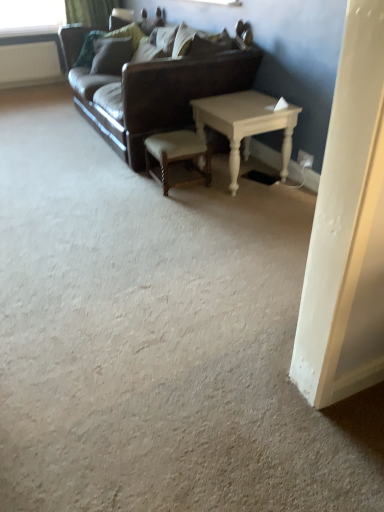
What is the approximate width of leather couch at center?

3.40 feet.

The height and width of the screenshot is (512, 384). Describe the element at coordinates (90, 12) in the screenshot. I see `green fabric curtain at upper left` at that location.

Locate an element on the screen. The width and height of the screenshot is (384, 512). velvet green pillow at upper center, which is the second pillow in front-to-back order is located at coordinates (111, 55).

You are a GUI agent. You are given a task and a screenshot of the screen. Output one action in this format:
    pyautogui.click(x=<x>, y=<y>)
    Task: Click on the white wood table at center
    This screenshot has width=384, height=512.
    Given the screenshot: What is the action you would take?
    pyautogui.click(x=245, y=124)

Identify the location of leather couch at center. This screenshot has width=384, height=512. (156, 86).

Is white wood table at center oriented towards velvet green pillow at upper center, acting as the 1th pillow starting from the back?

No.

I want to click on pillow that is the 2nd object to the left of the white wood table at center, starting at the anchor, so click(x=111, y=55).

Considering the relative positions of white wood table at center and velvet green pillow at upper center, acting as the 1th pillow starting from the back, in the image provided, is white wood table at center to the left or to the right of velvet green pillow at upper center, acting as the 1th pillow starting from the back,?

Based on their positions, white wood table at center is located to the right of velvet green pillow at upper center, acting as the 1th pillow starting from the back.

Is the depth of white wood table at center less than that of velvet green pillow at upper center, which is the second pillow in front-to-back order?

Yes, white wood table at center is closer to the camera.

Would you say wooden polished stool at center is to the left or to the right of green fabric curtain at upper left in the picture?

From the image, it's evident that wooden polished stool at center is to the right of green fabric curtain at upper left.

Is wooden polished stool at center situated inside green fabric curtain at upper left or outside?

wooden polished stool at center cannot be found inside green fabric curtain at upper left.

From a real-world perspective, is wooden polished stool at center physically below green fabric curtain at upper left?

Yes, from a real-world perspective, wooden polished stool at center is beneath green fabric curtain at upper left.

How different are the orientations of green fabric curtain at upper left and white plastic radiator at upper left in degrees?

The facing directions of green fabric curtain at upper left and white plastic radiator at upper left are 0.333 degrees apart.

From a real-world perspective, is green fabric curtain at upper left below white plastic radiator at upper left?

No, from a real-world perspective, green fabric curtain at upper left is not below white plastic radiator at upper left.

Which is further, (100, 27) or (37, 71)?

The point (37, 71) is more distant.

Is suede-like beige pillow at upper center, acting as the first pillow starting from the right, to the left or to the right of wooden polished stool at center in the image?

In the image, suede-like beige pillow at upper center, acting as the first pillow starting from the right, appears on the right side of wooden polished stool at center.

Is suede-like beige pillow at upper center, acting as the first pillow starting from the right, next to wooden polished stool at center?

No, suede-like beige pillow at upper center, acting as the first pillow starting from the right, is not next to wooden polished stool at center.

Measure the distance between suede-like beige pillow at upper center, acting as the first pillow starting from the right, and wooden polished stool at center.

They are 37.29 inches apart.

Is white wood table at center in front of or behind wooden polished stool at center in the image?

In the image, white wood table at center appears in front of wooden polished stool at center.

Is wooden polished stool at center located within white wood table at center?

That's incorrect, wooden polished stool at center is not inside white wood table at center.

Is white wood table at center positioned with its back to wooden polished stool at center?

white wood table at center does not have its back to wooden polished stool at center.

Is point (236, 190) positioned after point (189, 136)?

That is False.

Measure the distance between leather couch at center and white wood table at center.

23.33 inches.

From a real-world perspective, is leather couch at center located higher than white wood table at center?

Indeed, from a real-world perspective, leather couch at center stands above white wood table at center.

Choose the correct answer: Is leather couch at center inside white wood table at center or outside it?

leather couch at center cannot be found inside white wood table at center.

Is leather couch at center positioned with its back to white wood table at center?

No, white wood table at center is not at the back of leather couch at center.

Identify the location of table in front of the white plastic radiator at upper left. This screenshot has width=384, height=512. (245, 124).

Is point (56, 47) behind point (229, 169)?

Yes.

From the image's perspective, between white plastic radiator at upper left and white wood table at center, which one is located above?

From the image's view, white plastic radiator at upper left is above.

Would you consider white plastic radiator at upper left to be distant from white wood table at center?

Yes, white plastic radiator at upper left is far from white wood table at center.

The width and height of the screenshot is (384, 512). What are the coordinates of `the 2nd pillow to the left when counting from the white wood table at center` in the screenshot? It's located at (111, 55).

This screenshot has height=512, width=384. In order to click on stool on the right side of green fabric curtain at upper left in this screenshot , I will do `click(178, 159)`.

From the picture: Based on their spatial positions, is wooden polished stool at center or green fabric curtain at upper left further from white plastic radiator at upper left?

wooden polished stool at center lies further to white plastic radiator at upper left than the other object.

When comparing their distances from suede-like beige pillow at upper center, positioned as the 1th pillow in front-to-back order, does velvet green pillow at upper center, which is the second pillow in front-to-back order, or green fabric curtain at upper left seem closer?

The object closer to suede-like beige pillow at upper center, positioned as the 1th pillow in front-to-back order, is velvet green pillow at upper center, which is the second pillow in front-to-back order.

When comparing their distances from wooden polished stool at center, does green fabric curtain at upper left or white wood table at center seem closer?

white wood table at center lies closer to wooden polished stool at center than the other object.

Estimate the real-world distances between objects in this image. Which object is closer to white wood table at center, wooden polished stool at center or green fabric curtain at upper left?

wooden polished stool at center.

Estimate the real-world distances between objects in this image. Which object is closer to suede-like beige pillow at upper center, acting as the second pillow starting from the back, wooden polished stool at center or green fabric curtain at upper left?

The object closer to suede-like beige pillow at upper center, acting as the second pillow starting from the back, is wooden polished stool at center.

Estimate the real-world distances between objects in this image. Which object is further from velvet green pillow at upper center, the 1th pillow viewed from the left, leather couch at center or white plastic radiator at upper left?

white plastic radiator at upper left is further to velvet green pillow at upper center, the 1th pillow viewed from the left.

From the image, which object appears to be farther from velvet green pillow at upper center, which is the second pillow in front-to-back order, white plastic radiator at upper left or leather couch at center?

white plastic radiator at upper left.

Which object lies further to the anchor point velvet green pillow at upper center, the 2th pillow from the right, white plastic radiator at upper left or white wood table at center?

white wood table at center is positioned further to the anchor velvet green pillow at upper center, the 2th pillow from the right.

Image resolution: width=384 pixels, height=512 pixels. What are the coordinates of `studio couch between suede-like beige pillow at upper center, acting as the second pillow starting from the back, and white wood table at center in the up-down direction` in the screenshot? It's located at (156, 86).

In order to click on curtain between suede-like beige pillow at upper center, acting as the first pillow starting from the right, and white plastic radiator at upper left from front to back in this screenshot , I will do `click(90, 12)`.

What are the coordinates of `pillow between velvet green pillow at upper center, acting as the 1th pillow starting from the back, and white wood table at center from top to bottom` in the screenshot? It's located at (190, 39).

The height and width of the screenshot is (512, 384). Find the location of `stool between leather couch at center and white plastic radiator at upper left from front to back`. stool between leather couch at center and white plastic radiator at upper left from front to back is located at coordinates (178, 159).